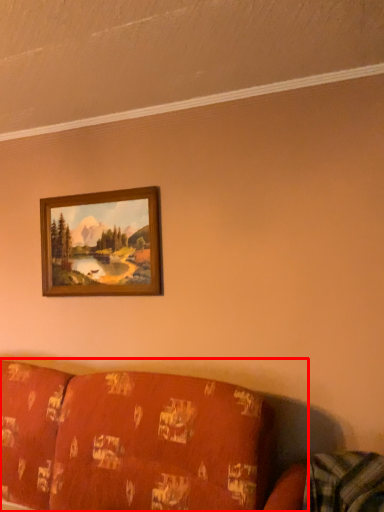
Question: From the image, what is the correct spatial relationship of studio couch (annotated by the red box) in relation to picture frame?

Choices:
 (A) right
 (B) left

Answer: (A)